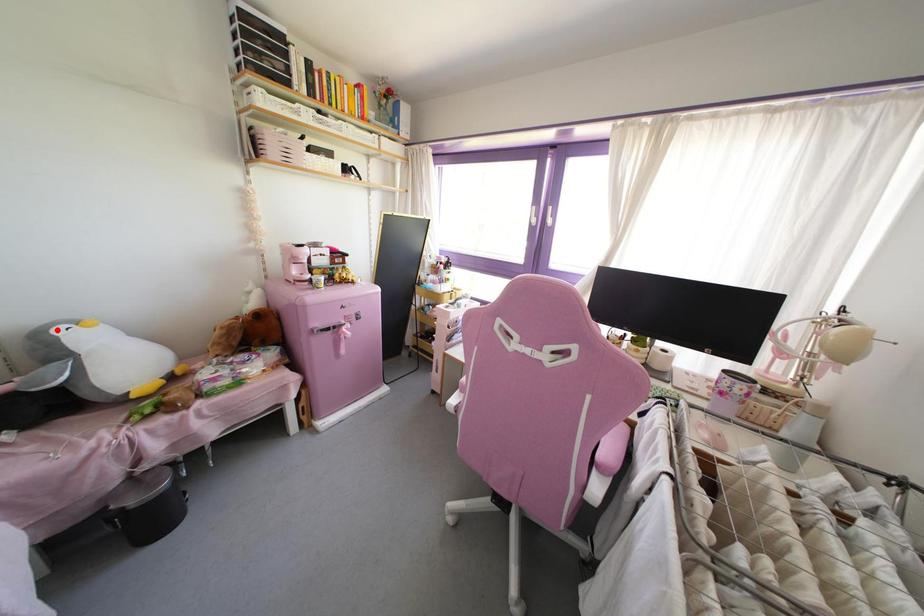
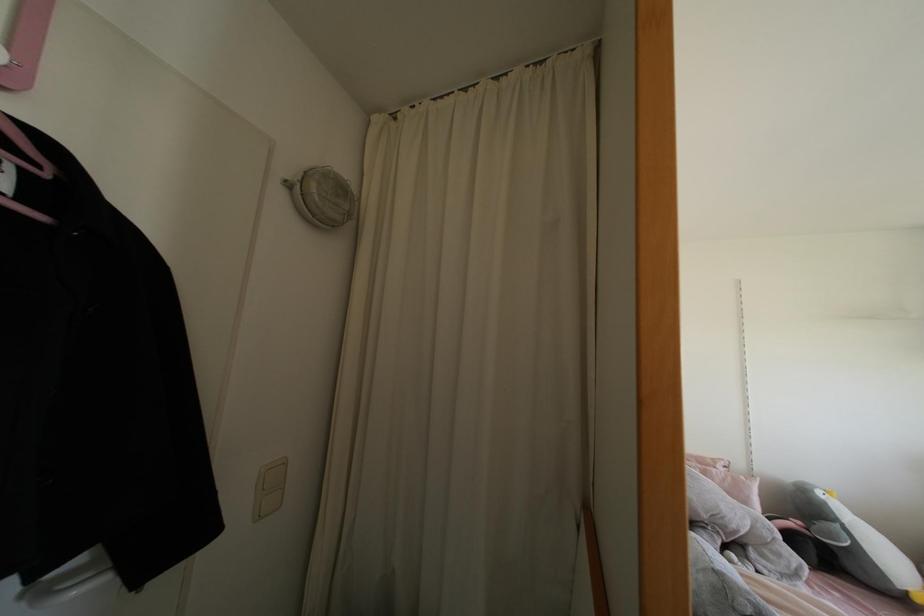
In the second image, find the point that corresponds to the highlighted location in the first image.

(819, 493)